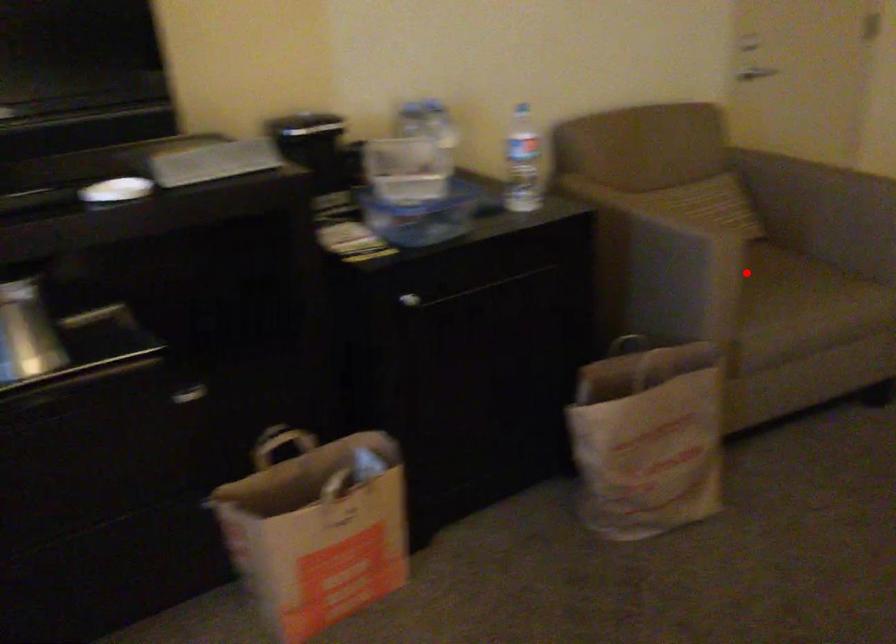
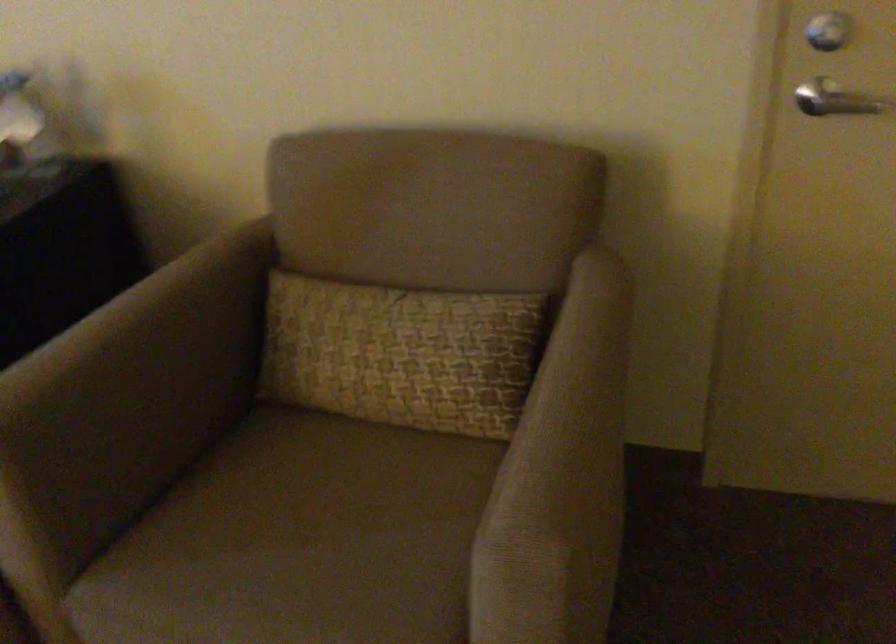
Question: I am providing you with two images of the same scene from different viewpoints. Given a red point in image1, look at the same physical point in image2. Is it:

Choices:
 (A) Closer to the viewpoint
 (B) Farther from the viewpoint

Answer: (A)